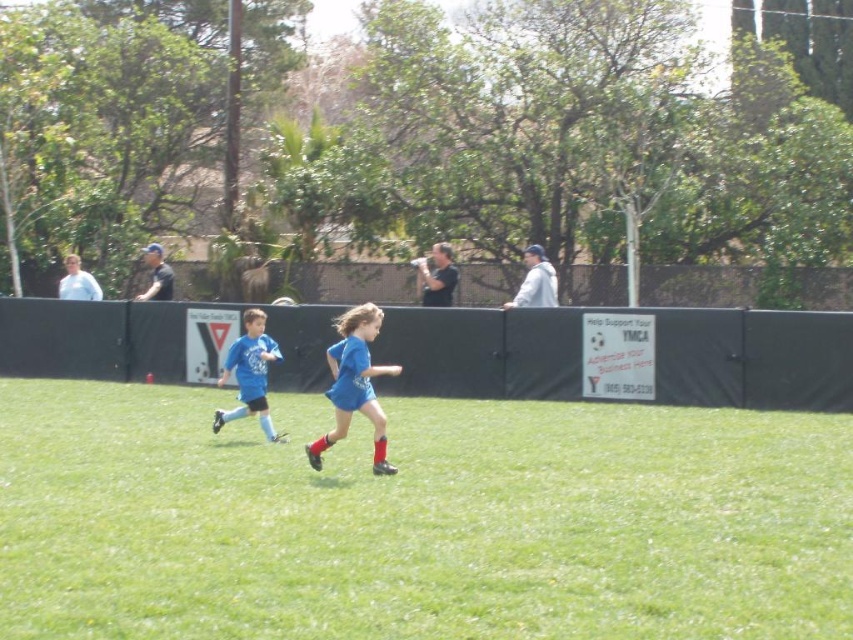
You are a soccer coach analyzing the game. You notice the green grass at center and the blue jersey at center. Which object is closer to the camera?

The blue jersey at center is closer to the camera because it is taller than the green grass at center.

You are a photographer standing behind the black fence. You want to capture a clear photo of the blue matte soccer jersey at center without the green grass at center blocking the view. Is this possible given their positions?

The green grass at center is in front of the blue matte soccer jersey at center, so it will block the view. You need to adjust your angle or move closer to ensure the jersey is visible without obstruction.

You are a photographer standing behind the black fence. You want to capture a photo of the blue matte soccer jersey at center and the green grass at center. Which object will appear larger in the photo?

The blue matte soccer jersey at center will appear larger in the photo because it is taller than the green grass at center.